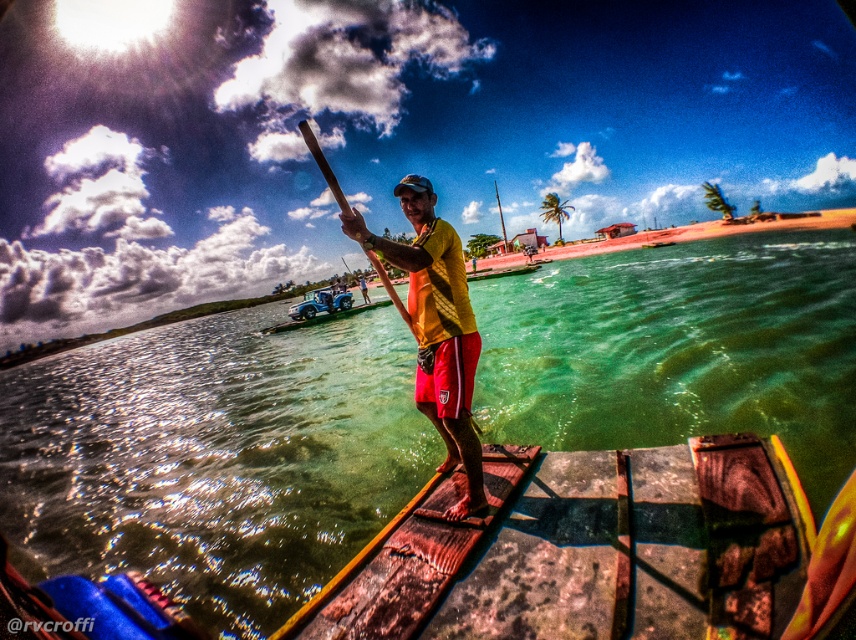
You are standing on the wooden dock and want to check the water quality at the point marked by coordinates point (214,458). Which object in the scene corresponds to this location?

The point (214,458) corresponds to the green translucent water at center.

You are a visitor at the dock and want to know if the wooden paddle at center is currently touching the green translucent water at center. Based on the scene, can you determine this?

The green translucent water at center is located below the wooden paddle at center, so the paddle is touching the water.

You are standing on the wooden planks at center and want to see the green translucent water at center. In which direction should you look?

You should look upward to see the green translucent water at center since it is located above the wooden planks at center.